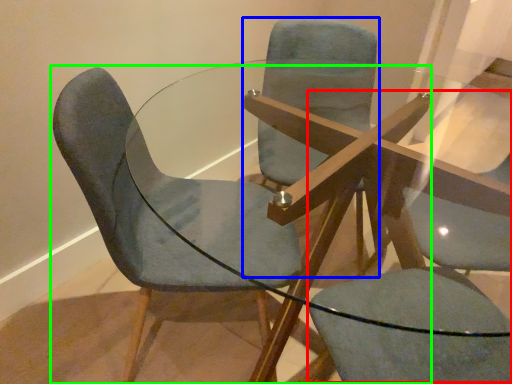
Question: Estimate the real-world distances between objects in this image. Which object is closer to swivel chair (highlighted by a red box), chair (highlighted by a blue box) or chair (highlighted by a green box)?

Choices:
 (A) chair
 (B) chair

Answer: (B)